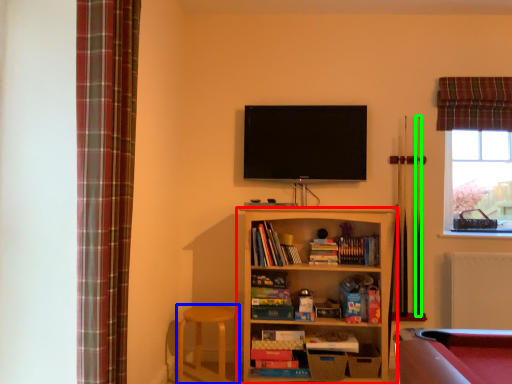
Question: Considering the real-world distances, which object is closest to shelf (highlighted by a red box)? bar stool (highlighted by a blue box) or cue (highlighted by a green box).

Choices:
 (A) bar stool
 (B) cue

Answer: (A)